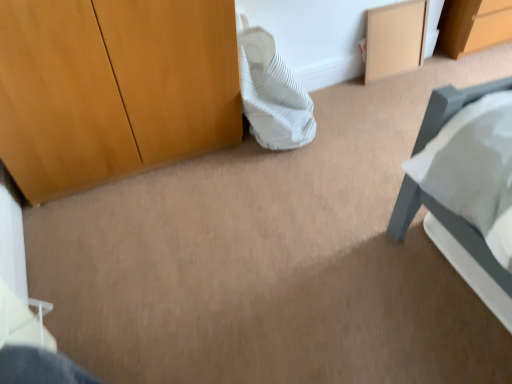
The width and height of the screenshot is (512, 384). Describe the element at coordinates (395, 39) in the screenshot. I see `beige matte cabinet at upper right` at that location.

Measure the distance between beige matte cabinet at upper right and camera.

A distance of 2.21 meters exists between beige matte cabinet at upper right and camera.

Locate an element on the screen. beige matte cabinet at upper right is located at coordinates (395, 39).

What is the approximate width of white striped pillow at center?

41.60 centimeters.

This screenshot has width=512, height=384. Identify the location of white striped pillow at center. (272, 93).

Describe the element at coordinates (272, 93) in the screenshot. I see `white striped pillow at center` at that location.

In order to face white striped pillow at center, should I rotate leftwards or rightwards?

It's best to rotate right around 3.098 degrees.

The width and height of the screenshot is (512, 384). In order to click on beige matte cabinet at upper right in this screenshot , I will do `click(395, 39)`.

Visually, is white striped pillow at center positioned to the left or to the right of beige matte cabinet at upper right?

white striped pillow at center is positioned on beige matte cabinet at upper right's left side.

In the image, is white striped pillow at center positioned in front of or behind beige matte cabinet at upper right?

white striped pillow at center is in front of beige matte cabinet at upper right.

Which point is more forward, [262,125] or [405,58]?

The point [262,125] is in front.

From the image's perspective, which one is positioned lower, white striped pillow at center or beige matte cabinet at upper right?

white striped pillow at center.

From a real-world perspective, between white striped pillow at center and beige matte cabinet at upper right, who is vertically lower?

beige matte cabinet at upper right.

Considering the relative sizes of white striped pillow at center and beige matte cabinet at upper right in the image provided, is white striped pillow at center wider than beige matte cabinet at upper right?

Yes.

Who is shorter, white striped pillow at center or beige matte cabinet at upper right?

beige matte cabinet at upper right is shorter.

Considering the sizes of objects white striped pillow at center and beige matte cabinet at upper right in the image provided, who is smaller, white striped pillow at center or beige matte cabinet at upper right?

Smaller between the two is beige matte cabinet at upper right.

Which is correct: white striped pillow at center is inside beige matte cabinet at upper right, or outside of it?

white striped pillow at center lies outside beige matte cabinet at upper right.

Is there a large distance between white striped pillow at center and beige matte cabinet at upper right?

white striped pillow at center is near beige matte cabinet at upper right, not far away.

Is white striped pillow at center facing away from beige matte cabinet at upper right?

That's not correct — white striped pillow at center is not looking away from beige matte cabinet at upper right.

Looking at this image, can you tell me how much white striped pillow at center and beige matte cabinet at upper right differ in facing direction?

2.34 degrees.

How far apart are white striped pillow at center and beige matte cabinet at upper right?

The distance of white striped pillow at center from beige matte cabinet at upper right is 27.19 inches.

I want to click on pillow in front of the beige matte cabinet at upper right, so click(272, 93).

Considering the positions of objects beige matte cabinet at upper right and white striped pillow at center in the image provided, who is more to the left, beige matte cabinet at upper right or white striped pillow at center?

white striped pillow at center is more to the left.

Who is more distant, beige matte cabinet at upper right or white striped pillow at center?

Positioned behind is beige matte cabinet at upper right.

Which point is more distant from viewer, (x=421, y=31) or (x=289, y=71)?

The point (x=421, y=31) is more distant.

From the image's perspective, between beige matte cabinet at upper right and white striped pillow at center, who is located below?

white striped pillow at center appears lower in the image.

From a real-world perspective, is beige matte cabinet at upper right positioned above or below white striped pillow at center?

From a real-world perspective, beige matte cabinet at upper right is physically below white striped pillow at center.

Can you confirm if beige matte cabinet at upper right is thinner than white striped pillow at center?

Correct, the width of beige matte cabinet at upper right is less than that of white striped pillow at center.

Between beige matte cabinet at upper right and white striped pillow at center, which one has more height?

white striped pillow at center.

Who is smaller, beige matte cabinet at upper right or white striped pillow at center?

With smaller size is beige matte cabinet at upper right.

Could white striped pillow at center be considered to be inside beige matte cabinet at upper right?

Actually, white striped pillow at center is outside beige matte cabinet at upper right.

Are beige matte cabinet at upper right and white striped pillow at center beside each other?

No, beige matte cabinet at upper right is not in contact with white striped pillow at center.

Is beige matte cabinet at upper right facing away from white striped pillow at center?

→ No, beige matte cabinet at upper right's orientation is not away from white striped pillow at center.

At what (x,y) coordinates should I click in order to perform the action: click on pillow below the beige matte cabinet at upper right (from the image's perspective). Please return your answer as a coordinate pair (x, y). The height and width of the screenshot is (384, 512). Looking at the image, I should click on (272, 93).

Locate an element on the screen. Image resolution: width=512 pixels, height=384 pixels. cabinetry located on the right of white striped pillow at center is located at coordinates (395, 39).

I want to click on pillow that appears below the beige matte cabinet at upper right (from the image's perspective), so click(272, 93).